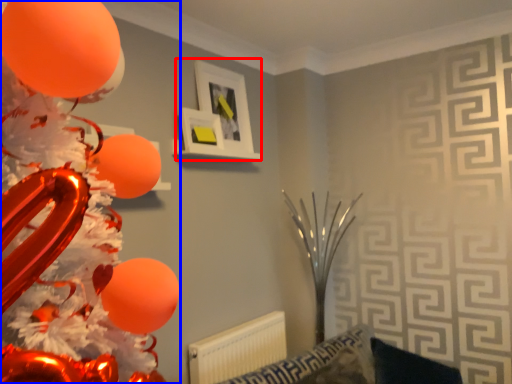
Question: Which object is further to the camera taking this photo, picture frame (highlighted by a red box) or balloon (highlighted by a blue box)?

Choices:
 (A) picture frame
 (B) balloon

Answer: (A)